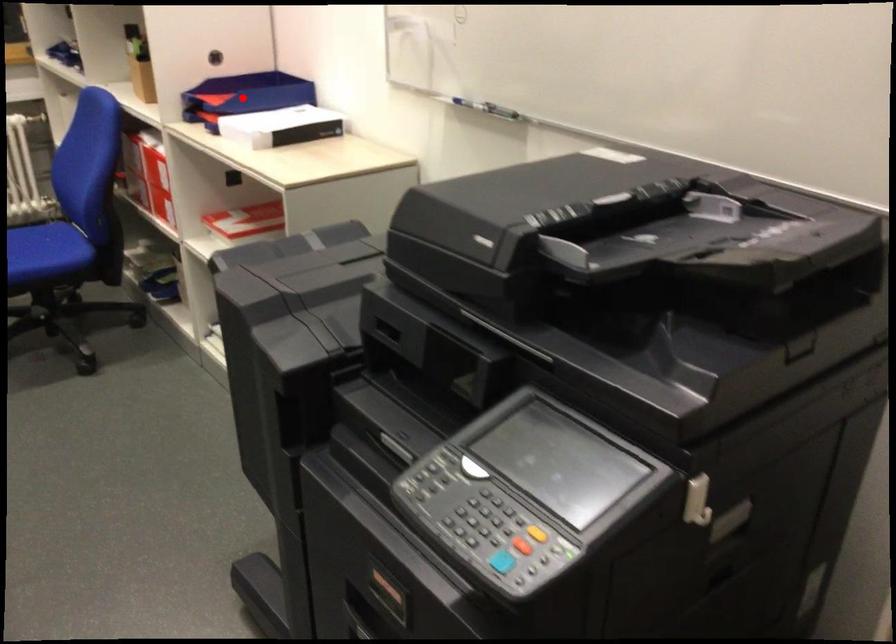
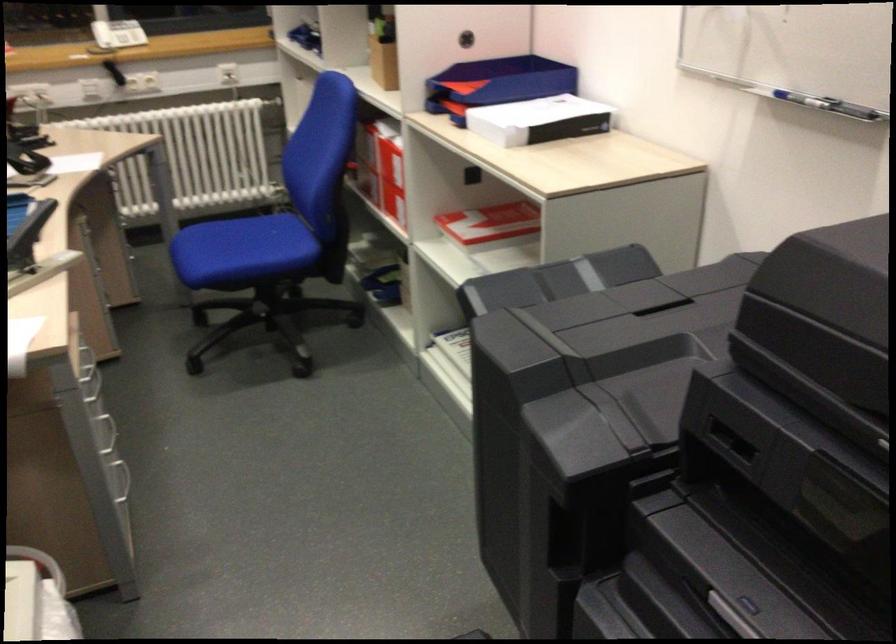
Question: I am providing you with two images of the same scene from different viewpoints. Given a red point in image1, look at the same physical point in image2. Is it:

Choices:
 (A) Closer to the viewpoint
 (B) Farther from the viewpoint

Answer: (A)